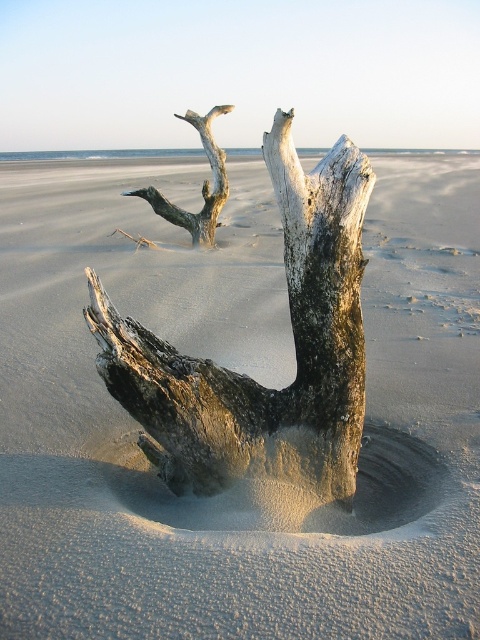
Question: Which point appears farthest from the camera in this image?

Choices:
 (A) (253, 442)
 (B) (217, 168)

Answer: (B)

Question: Does weathered wood driftwood at center appear on the left side of gray weathered wood at upper center?

Choices:
 (A) no
 (B) yes

Answer: (A)

Question: Which point is farther from the camera taking this photo?

Choices:
 (A) (204, 236)
 (B) (311, 236)

Answer: (A)

Question: In this image, where is weathered wood driftwood at center located relative to gray weathered wood at upper center?

Choices:
 (A) above
 (B) below

Answer: (B)

Question: Does weathered wood driftwood at center appear on the right side of gray weathered wood at upper center?

Choices:
 (A) yes
 (B) no

Answer: (A)